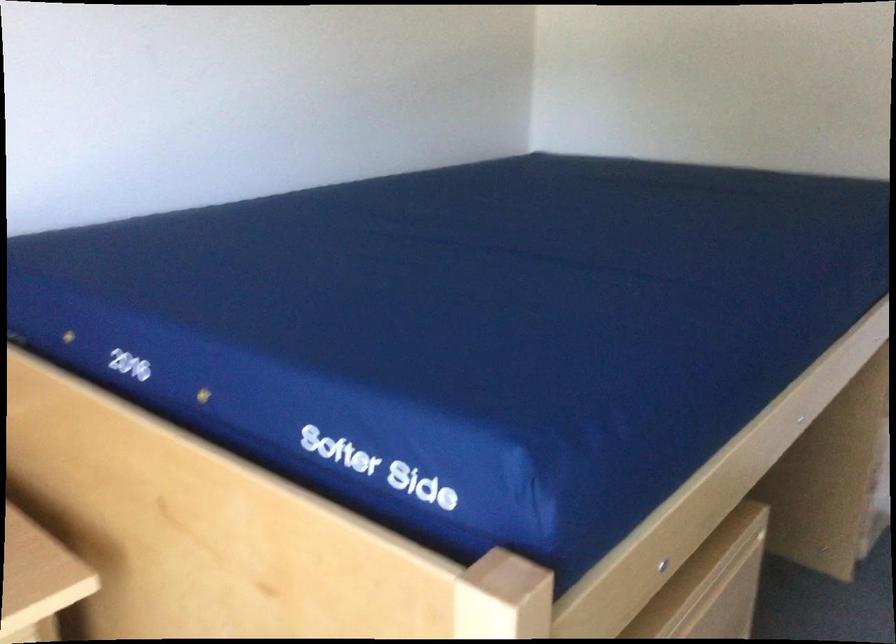
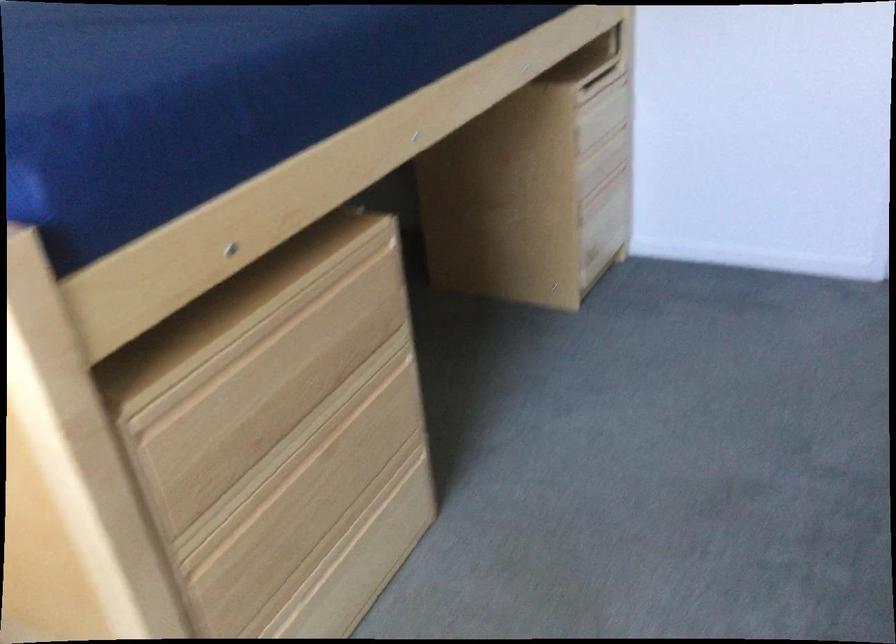
The images are taken continuously from a first-person perspective. In which direction are you moving?

The cameraman moved toward right, backward.